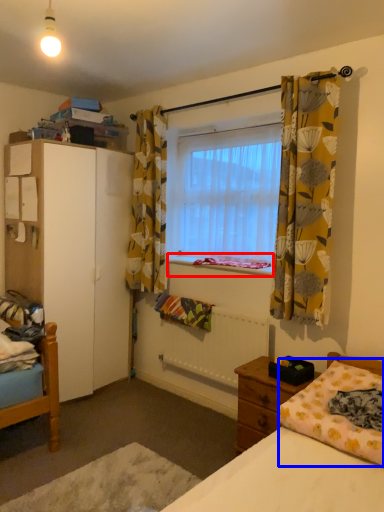
Question: Among these objects, which one is nearest to the camera, window sill (highlighted by a red box) or mattress (highlighted by a blue box)?

Choices:
 (A) window sill
 (B) mattress

Answer: (B)